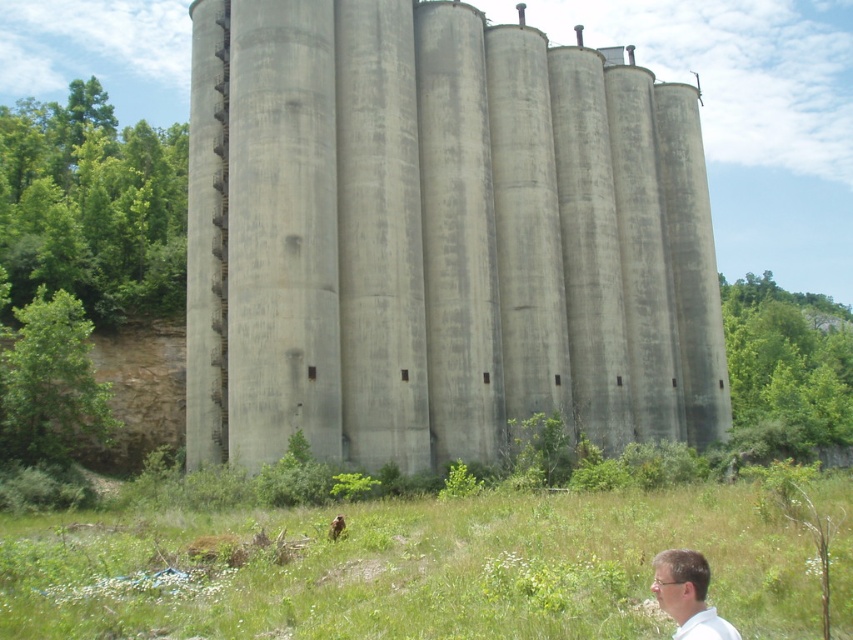
You are standing in front of the industrial silos and notice the green grass at lower center and the white matte shirt at lower right. Which object is positioned closer to the left side of the scene?

The green grass at lower center is positioned to the left of the white matte shirt at lower right, so it is closer to the left side of the scene.